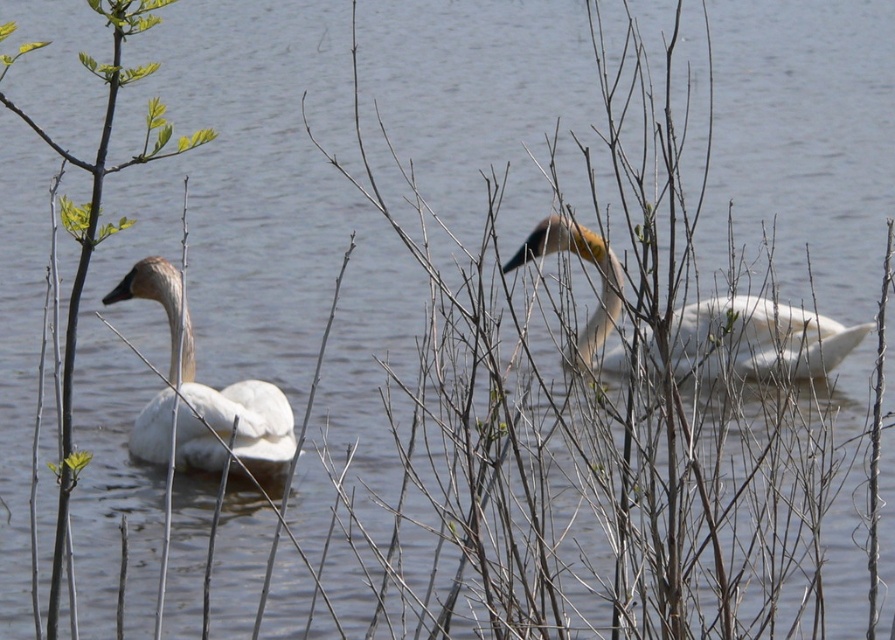
Question: Among these points, which one is nearest to the camera?

Choices:
 (A) (40, 129)
 (B) (651, 337)

Answer: (B)

Question: Can you confirm if white matte swan at center is thinner than green leafy branch at left?

Choices:
 (A) yes
 (B) no

Answer: (B)

Question: Can you confirm if white matte swan at left is positioned to the right of green leafy branch at left?

Choices:
 (A) yes
 (B) no

Answer: (B)

Question: Which of the following is the closest to the observer?

Choices:
 (A) (64, 515)
 (B) (849, 326)

Answer: (A)

Question: Does white matte swan at left have a greater width compared to green leafy branch at left?

Choices:
 (A) yes
 (B) no

Answer: (A)

Question: Considering the real-world distances, which object is farthest from the white matte swan at left?

Choices:
 (A) white matte swan at center
 (B) green leafy branch at left

Answer: (B)